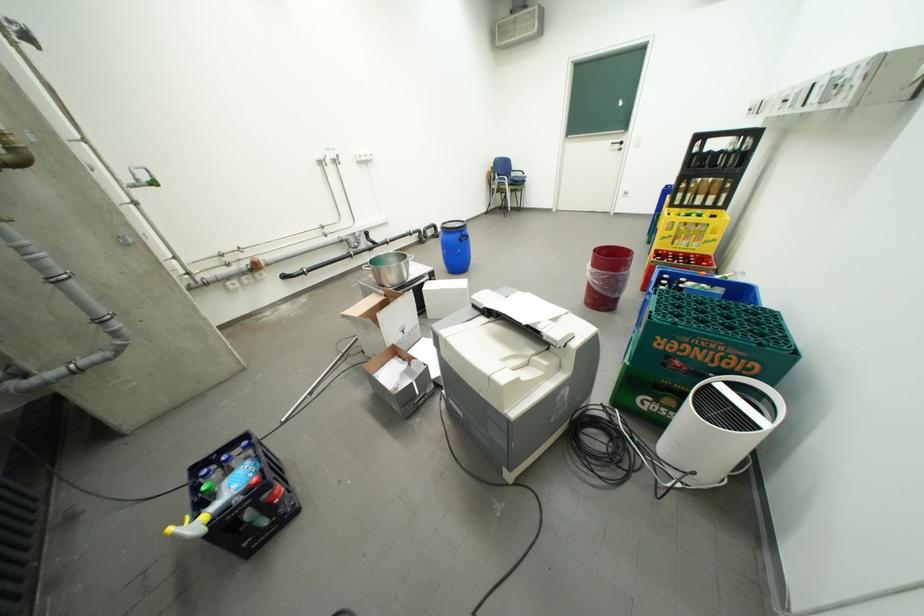
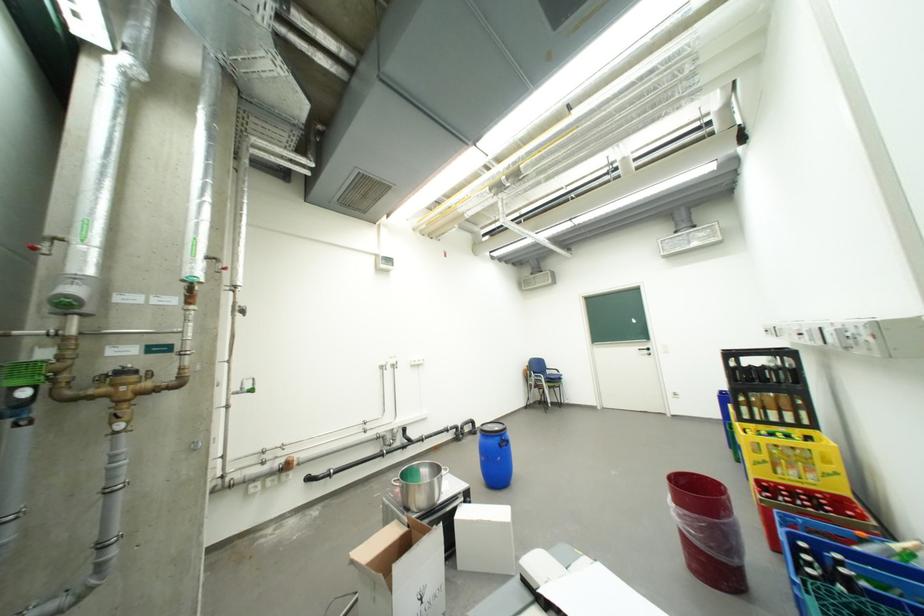
Locate, in the second image, the point that corresponds to [623,145] in the first image.

(650, 351)